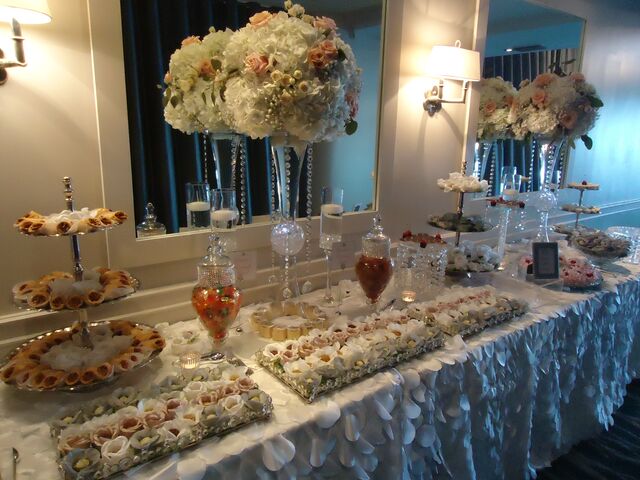
Find the location of `tiered serving tray`. tiered serving tray is located at coordinates (72, 252), (461, 204), (582, 198).